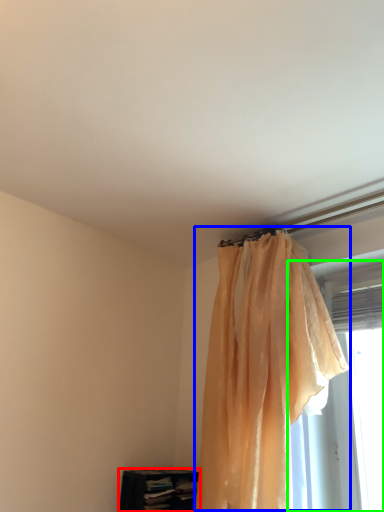
Question: Which object is the farthest from furniture (highlighted by a red box)? Choose among these: curtain (highlighted by a blue box) or window (highlighted by a green box).

Choices:
 (A) curtain
 (B) window

Answer: (B)